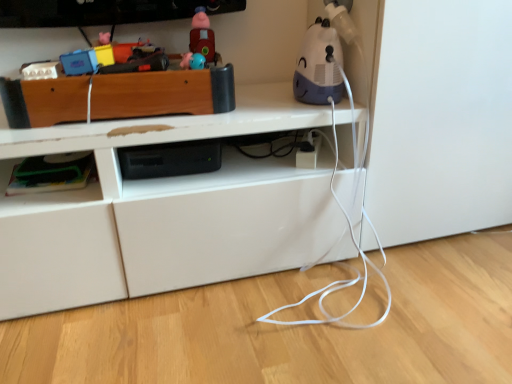
Question: Considering the relative positions of green plastic container at lower left, marked as the second shelf in a top-to-bottom arrangement, and wooden toy box at upper left, which is the 2th shelf in bottom-to-top order, in the image provided, is green plastic container at lower left, marked as the second shelf in a top-to-bottom arrangement, to the left of wooden toy box at upper left, which is the 2th shelf in bottom-to-top order, from the viewer's perspective?

Choices:
 (A) yes
 (B) no

Answer: (A)

Question: Can you confirm if green plastic container at lower left, which is the 1th shelf from bottom to top, is smaller than wooden toy box at upper left, the first shelf in the top-to-bottom sequence?

Choices:
 (A) yes
 (B) no

Answer: (A)

Question: Is green plastic container at lower left, marked as the second shelf in a top-to-bottom arrangement, positioned far away from wooden toy box at upper left, which is the 2th shelf in bottom-to-top order?

Choices:
 (A) no
 (B) yes

Answer: (A)

Question: From a real-world perspective, is green plastic container at lower left, which is the 1th shelf from bottom to top, positioned under wooden toy box at upper left, which is the 2th shelf in bottom-to-top order, based on gravity?

Choices:
 (A) no
 (B) yes

Answer: (B)

Question: Is green plastic container at lower left, marked as the second shelf in a top-to-bottom arrangement, positioned behind wooden toy box at upper left, the first shelf in the top-to-bottom sequence?

Choices:
 (A) no
 (B) yes

Answer: (B)

Question: Considering their positions, is white plastic humidifier at upper right, which ranks as the 2th toy in left-to-right order, located in front of or behind green plastic container at lower left, which is the 1th shelf from bottom to top?

Choices:
 (A) front
 (B) behind

Answer: (A)

Question: Does point (300, 82) appear closer or farther from the camera than point (2, 211)?

Choices:
 (A) farther
 (B) closer

Answer: (A)

Question: Is white plastic humidifier at upper right, which is the first toy from right to left, wider or thinner than green plastic container at lower left, marked as the second shelf in a top-to-bottom arrangement?

Choices:
 (A) wide
 (B) thin

Answer: (B)

Question: Is white plastic humidifier at upper right, which ranks as the 2th toy in left-to-right order, spatially inside green plastic container at lower left, which is the 1th shelf from bottom to top, or outside of it?

Choices:
 (A) outside
 (B) inside

Answer: (A)

Question: From their relative heights in the image, would you say white plastic humidifier at upper right, which is the first toy from right to left, is taller or shorter than rubberized red train at upper center, which ranks as the first toy in left-to-right order?

Choices:
 (A) tall
 (B) short

Answer: (A)

Question: Would you say white plastic humidifier at upper right, which ranks as the 2th toy in left-to-right order, is to the left or to the right of rubberized red train at upper center, which ranks as the first toy in left-to-right order, in the picture?

Choices:
 (A) left
 (B) right

Answer: (B)

Question: Which is correct: white plastic humidifier at upper right, which is the first toy from right to left, is inside rubberized red train at upper center, marked as the second toy in a right-to-left arrangement, or outside of it?

Choices:
 (A) outside
 (B) inside

Answer: (A)

Question: Considering their positions, is white plastic humidifier at upper right, which ranks as the 2th toy in left-to-right order, located in front of or behind rubberized red train at upper center, which ranks as the first toy in left-to-right order?

Choices:
 (A) behind
 (B) front

Answer: (B)

Question: From the image's perspective, relative to wooden toy box at upper left, the first shelf in the top-to-bottom sequence, is green plastic container at lower left, which is the 1th shelf from bottom to top, above or below?

Choices:
 (A) below
 (B) above

Answer: (A)

Question: Does point (0, 192) appear closer or farther from the camera than point (214, 109)?

Choices:
 (A) farther
 (B) closer

Answer: (B)